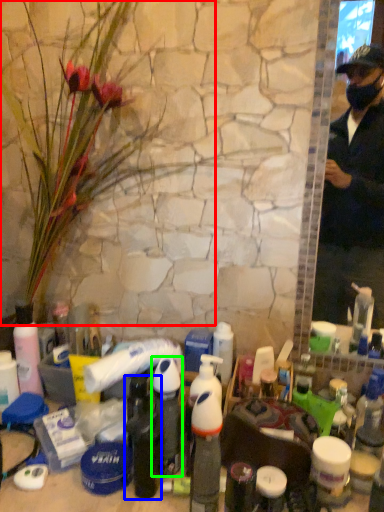
Question: Based on their relative distances, which object is nearer to flower (highlighted by a red box)? Choose from bottle (highlighted by a blue box) and bottle (highlighted by a green box).

Choices:
 (A) bottle
 (B) bottle

Answer: (B)